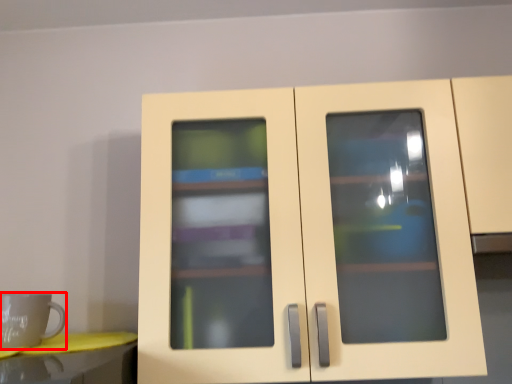
Question: From the image's perspective, where is mug (annotated by the red box) located in relation to cupboard in the image?

Choices:
 (A) above
 (B) below

Answer: (B)